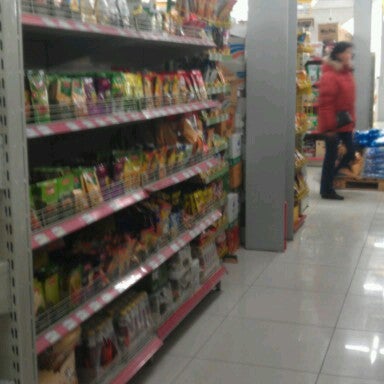
This screenshot has height=384, width=384. Identify the location of columns. (275, 128), (365, 53).